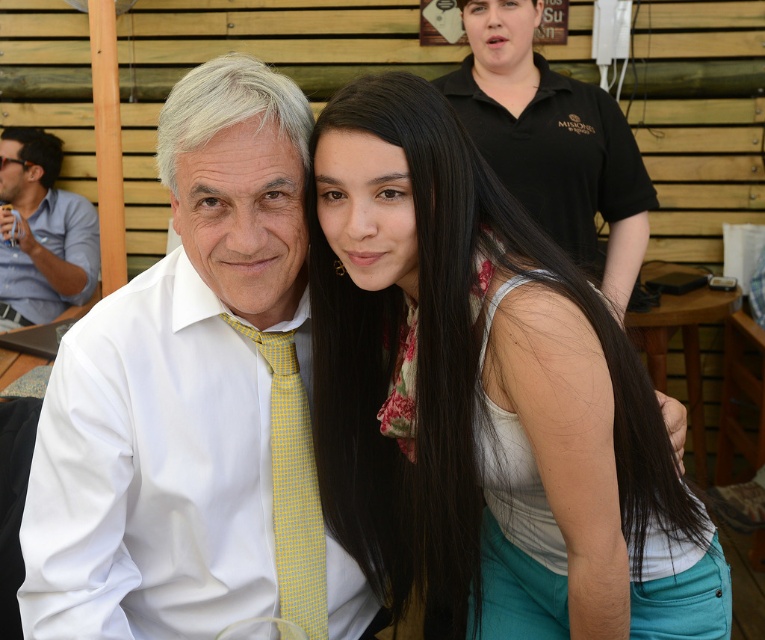
Question: Where is matte blue shirt at left located in relation to yellow checkered tie at center in the image?

Choices:
 (A) left
 (B) right

Answer: (A)

Question: Which object is closer to the camera taking this photo?

Choices:
 (A) yellow checkered tie at center
 (B) matte blue shirt at left
 (C) white smooth shirt at center

Answer: (C)

Question: Is white smooth shirt at center above yellow checkered tie at center?

Choices:
 (A) no
 (B) yes

Answer: (B)

Question: Can you confirm if white fabric top at center is positioned to the left of white smooth shirt at center?

Choices:
 (A) yes
 (B) no

Answer: (B)

Question: Which point appears farthest from the camera in this image?

Choices:
 (A) (298, 604)
 (B) (295, 609)
 (C) (568, 442)

Answer: (B)

Question: Considering the real-world distances, which object is farthest from the white fabric top at center?

Choices:
 (A) white smooth shirt at center
 (B) yellow checkered tie at center

Answer: (B)